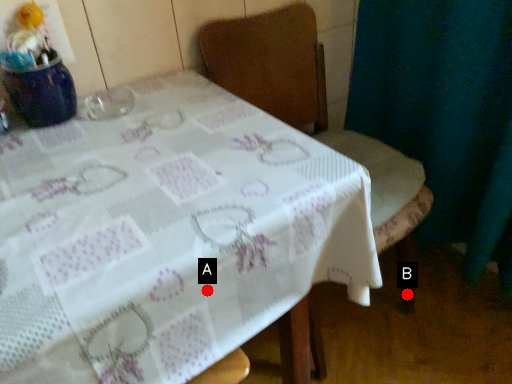
Question: Two points are circled on the image, labeled by A and B beside each circle. Which point is farther to the camera?

Choices:
 (A) A is further
 (B) B is further

Answer: (B)